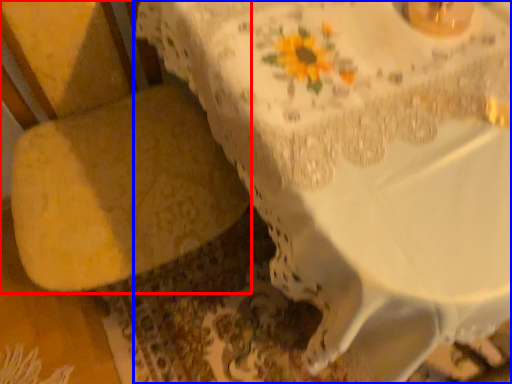
Question: Which point is further to the camera, armchair (highlighted by a red box) or table (highlighted by a blue box)?

Choices:
 (A) armchair
 (B) table

Answer: (B)